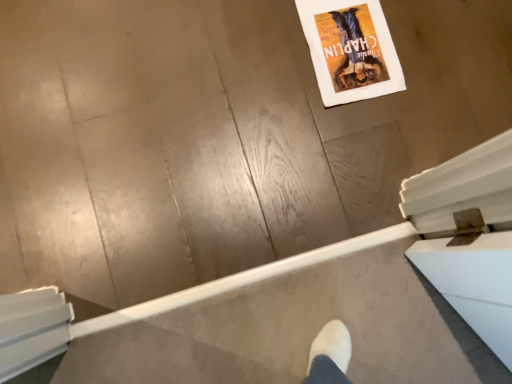
Identify the location of vacant region below white paper towel at upper center (from a real-world perspective). The height and width of the screenshot is (384, 512). (344, 41).